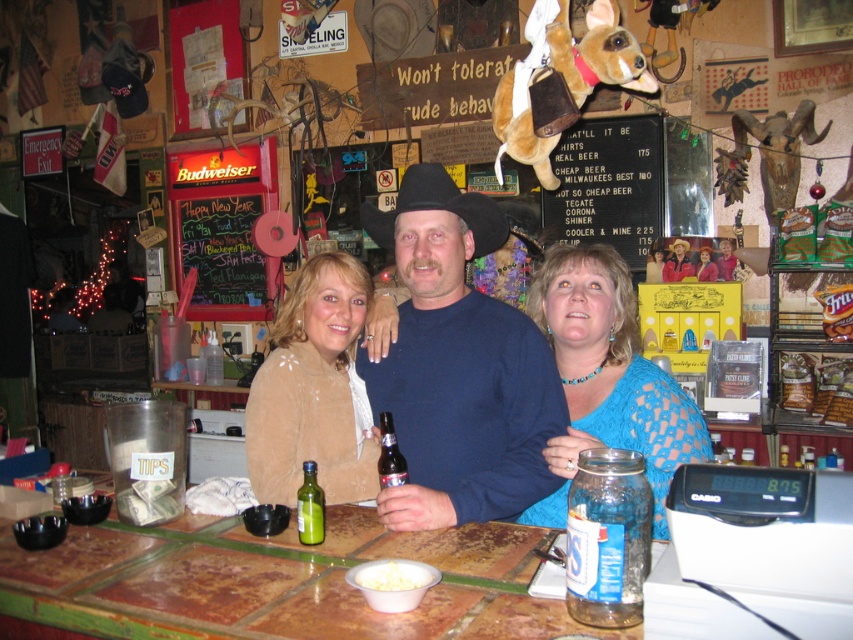
You are a customer at the rustic bar and want to place your phone on the table without it tipping over. Which object, the brown tile table at center or the clear glass jar at center, would be more stable for placing your phone?

The brown tile table at center is larger in size than the clear glass jar at center, so placing the phone on the brown tile table at center would be more stable.

You are a bartender at the rustic bar and need to place a new drink order on the brown tile table at center. However, there is a customer wearing a blue knit sweater at center in your way. Can you easily access the table without disturbing them?

The blue knit sweater at center is located above brown tile table at center, meaning the customer is sitting at the table. Since the sweater is above the table, the customer is likely seated there, so you would need to ask them to move or work around them to access the table.